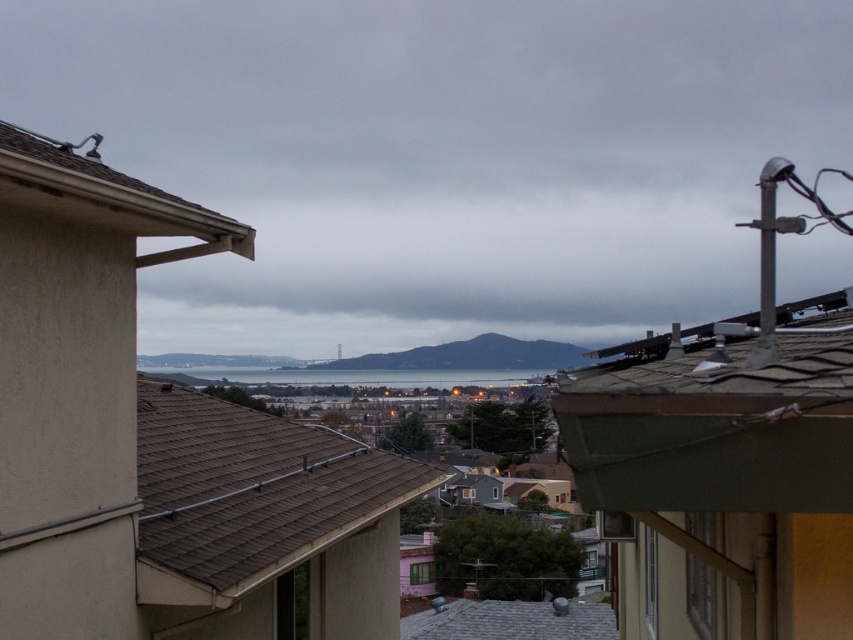
Question: Which of the following is the farthest from the observer?

Choices:
 (A) (161, 538)
 (B) (693, 458)

Answer: (A)

Question: Estimate the real-world distances between objects in this image. Which object is farther from the brown shingles at upper left?

Choices:
 (A) gray shingles at center
 (B) green shingles at upper right
 (C) brown shingles at center

Answer: (A)

Question: Can you confirm if green shingles at upper right is wider than gray shingles at center?

Choices:
 (A) no
 (B) yes

Answer: (A)

Question: Where is brown shingles at upper left located in relation to gray shingles at center in the image?

Choices:
 (A) right
 (B) left

Answer: (B)

Question: Does green shingles at upper right lie in front of brown shingles at center?

Choices:
 (A) no
 (B) yes

Answer: (B)

Question: Which object is the closest to the brown shingles at upper left?

Choices:
 (A) brown shingles at center
 (B) green shingles at upper right

Answer: (A)